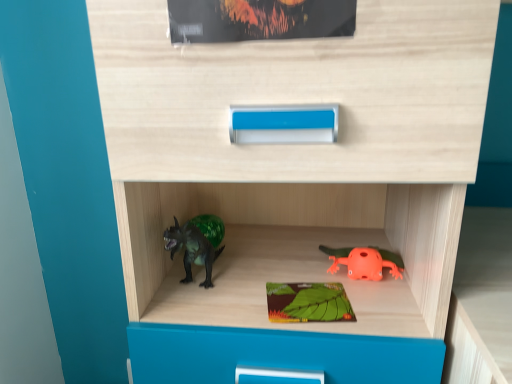
Question: Is orange matte frog at lower right turned away from matte green paperback book at upper center, acting as the first paperback book starting from the top?

Choices:
 (A) no
 (B) yes

Answer: (A)

Question: Could you tell me if orange matte frog at lower right is facing matte green paperback book at upper center, the 1th paperback book viewed from the front?

Choices:
 (A) yes
 (B) no

Answer: (B)

Question: Is orange matte frog at lower right positioned in front of matte green paperback book at upper center, arranged as the 2th paperback book when ordered from the bottom?

Choices:
 (A) no
 (B) yes

Answer: (A)

Question: Is orange matte frog at lower right positioned beyond the bounds of matte green paperback book at upper center, arranged as the 2th paperback book when ordered from the bottom?

Choices:
 (A) yes
 (B) no

Answer: (A)

Question: From the image's perspective, does orange matte frog at lower right appear lower than matte green paperback book at upper center, arranged as the 2th paperback book when ordered from the bottom?

Choices:
 (A) yes
 (B) no

Answer: (A)

Question: Considering the relative sizes of orange matte frog at lower right and matte green paperback book at upper center, marked as the 2th paperback book in a back-to-front arrangement, in the image provided, is orange matte frog at lower right smaller than matte green paperback book at upper center, marked as the 2th paperback book in a back-to-front arrangement,?

Choices:
 (A) no
 (B) yes

Answer: (B)

Question: Does orange matte frog at lower right turn towards green matte board game at center, which ranks as the 1th paperback book in bottom-to-top order?

Choices:
 (A) no
 (B) yes

Answer: (A)

Question: Does orange matte frog at lower right have a smaller size compared to green matte board game at center, positioned as the 1th paperback book in back-to-front order?

Choices:
 (A) no
 (B) yes

Answer: (A)

Question: Is orange matte frog at lower right in contact with green matte board game at center, placed as the second paperback book when sorted from front to back?

Choices:
 (A) yes
 (B) no

Answer: (B)

Question: Can you confirm if orange matte frog at lower right is taller than green matte board game at center, positioned as the 1th paperback book in back-to-front order?

Choices:
 (A) no
 (B) yes

Answer: (B)

Question: From the image's perspective, does orange matte frog at lower right appear lower than green matte board game at center, placed as the second paperback book when sorted from front to back?

Choices:
 (A) yes
 (B) no

Answer: (B)

Question: Does orange matte frog at lower right lie in front of green matte board game at center, which is counted as the 2th paperback book, starting from the top?

Choices:
 (A) no
 (B) yes

Answer: (A)

Question: Can you confirm if matte green paperback book at upper center, acting as the first paperback book starting from the top, is taller than orange matte frog at lower right?

Choices:
 (A) no
 (B) yes

Answer: (B)